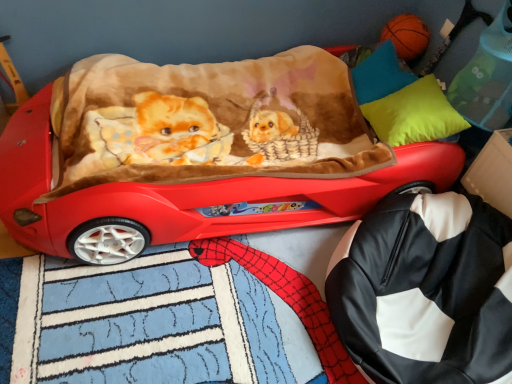
Question: Considering the positions of shiny red car at center and neon yellow fabric pillow at upper right, the second pillow in the top-to-bottom sequence, in the image, is shiny red car at center wider or thinner than neon yellow fabric pillow at upper right, the second pillow in the top-to-bottom sequence,?

Choices:
 (A) thin
 (B) wide

Answer: (B)

Question: From a real-world perspective, is shiny red car at center above or below neon yellow fabric pillow at upper right, the second pillow in the top-to-bottom sequence?

Choices:
 (A) above
 (B) below

Answer: (B)

Question: Estimate the real-world distances between objects in this image. Which object is farther from the matte blue pillow at upper right, positioned as the 1th pillow in top-to-bottom order?

Choices:
 (A) shiny red car at center
 (B) neon yellow fabric pillow at upper right, which ranks as the first pillow in bottom-to-top order
 (C) black leather bag at lower right

Answer: (C)

Question: Based on their relative distances, which object is nearer to the shiny red car at center?

Choices:
 (A) neon yellow fabric pillow at upper right, the second pillow in the top-to-bottom sequence
 (B) matte blue pillow at upper right, positioned as the 1th pillow in top-to-bottom order
 (C) black leather bag at lower right

Answer: (A)